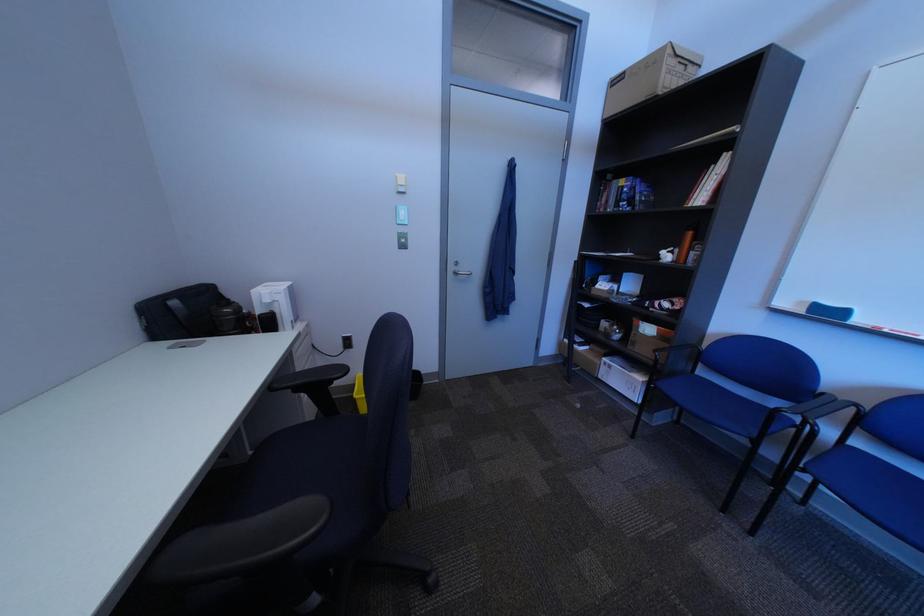
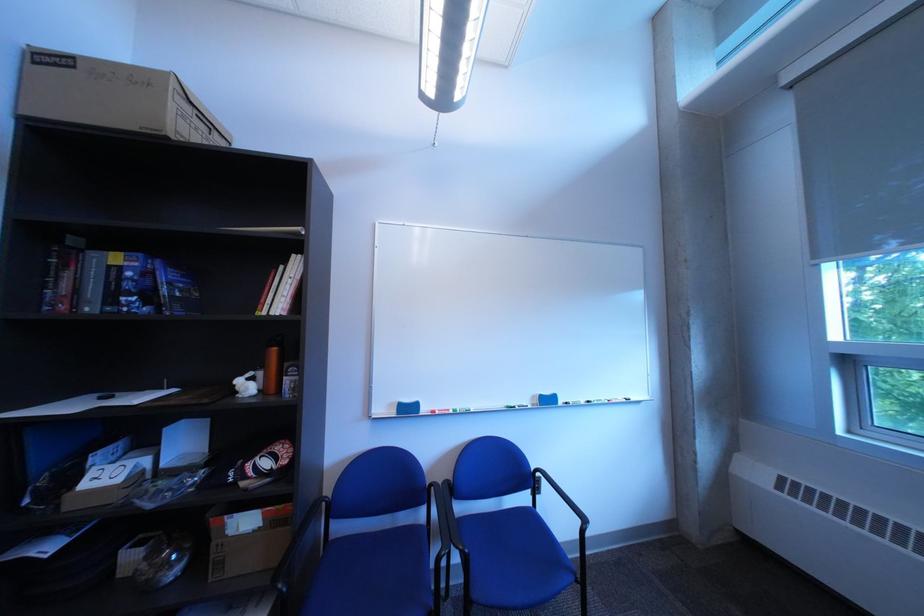
The point at (650, 345) is marked in the first image. Where is the corresponding point in the second image?

(237, 565)